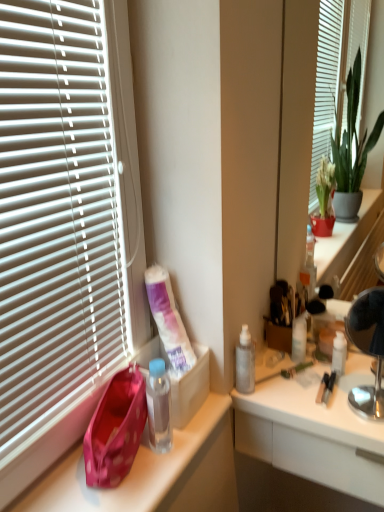
At what (x,y) coordinates should I click in order to perform the action: click on empty space that is ontop of translucent plastic bottles at center (from a real-world perspective). Please return your answer as a coordinate pair (x, y). Image resolution: width=384 pixels, height=512 pixels. Looking at the image, I should click on (318, 379).